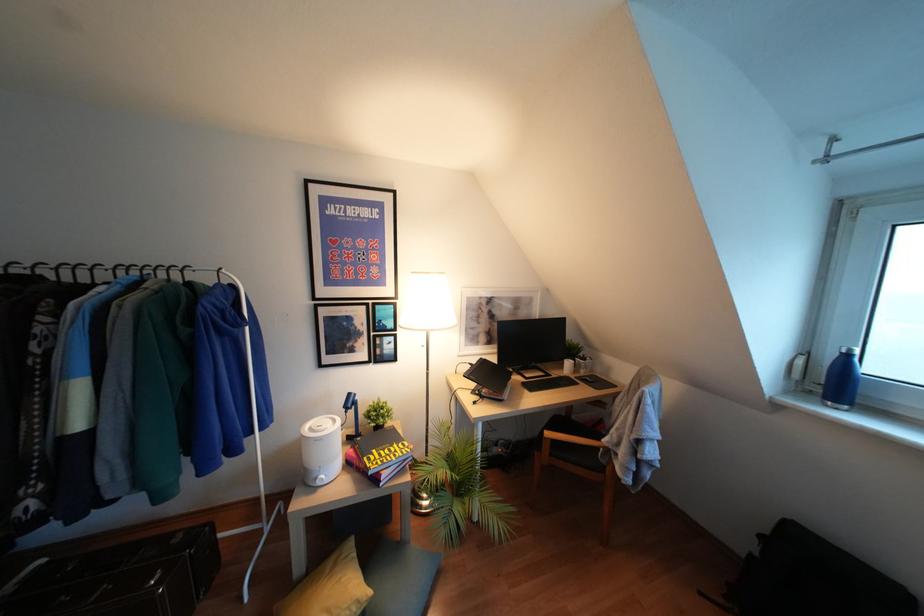
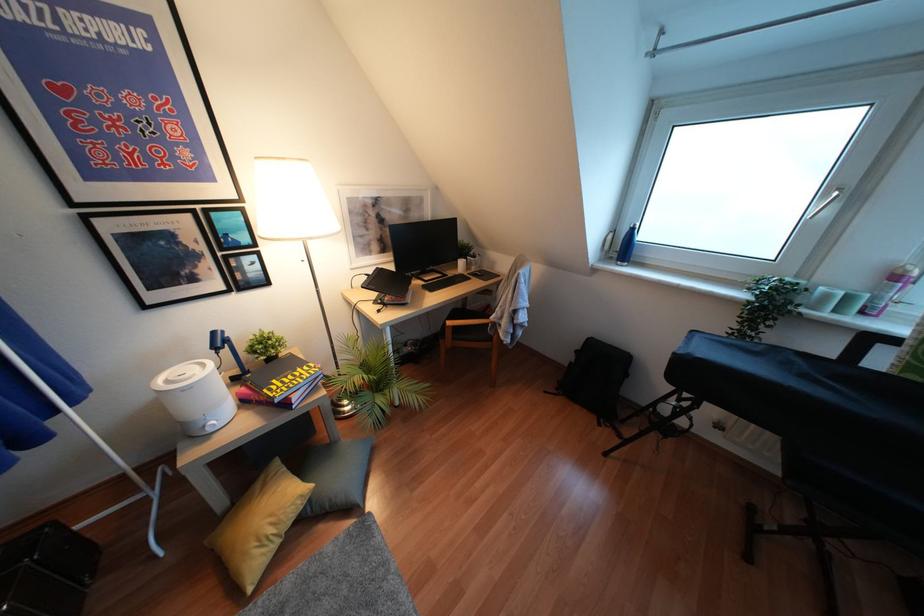
In the second image, find the point that corresponds to pixel 833 379 in the first image.

(623, 246)